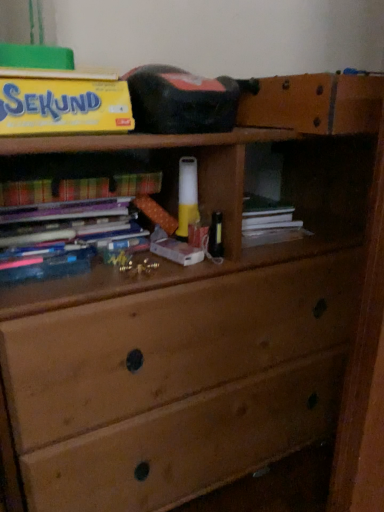
Where is `empty space that is ontop of multicolored paper book at left (from a real-world perspective)`? empty space that is ontop of multicolored paper book at left (from a real-world perspective) is located at coordinates (67, 165).